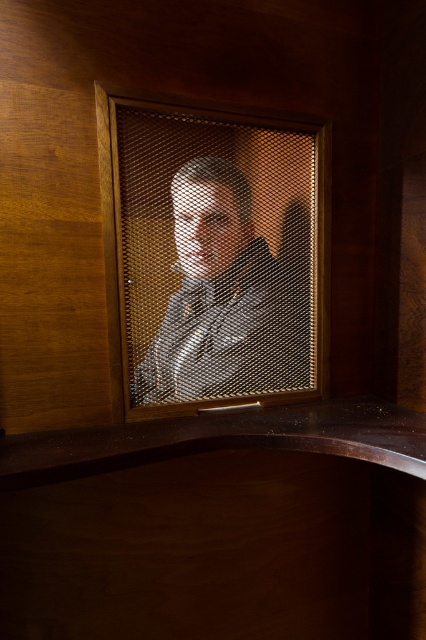
Who is more distant from viewer, (253, 180) or (230, 300)?

Positioned behind is point (253, 180).

Between metal mesh at center and matte black shirt at center, which one appears on the right side from the viewer's perspective?

Positioned to the right is matte black shirt at center.

You are a GUI agent. You are given a task and a screenshot of the screen. Output one action in this format:
    pyautogui.click(x=<x>, y=<y>)
    Task: Click on the metal mesh at center
    The width and height of the screenshot is (426, 640).
    Given the screenshot: What is the action you would take?
    pyautogui.click(x=210, y=256)

I want to click on metal mesh at center, so click(x=210, y=256).